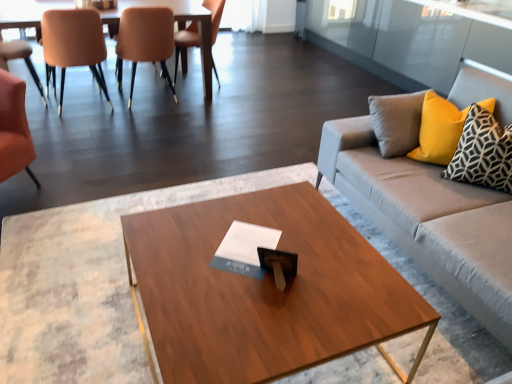
Where is `free space to the right of wooden table at upper left`? free space to the right of wooden table at upper left is located at coordinates (240, 109).